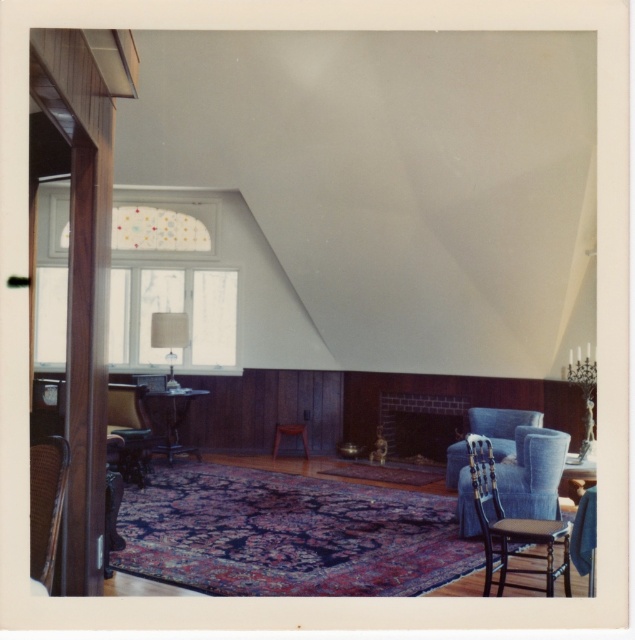
You are sitting in the wooden chair at lower right and want to place a book on the wooden side table at center. Can you reach it without moving from your seat?

The wooden chair at lower right is located below the wooden side table at center, meaning the side table is higher up. Since you are sitting in the chair, you might need to stand or use a step stool to reach the table unless it is within arm sreach.

You are standing in the room and want to place a small table between the wooden chair at lower right and the white fabric lampshade at center. Can you do this without moving either object?

The wooden chair at lower right is located below the white fabric lampshade at center, so there is space between them to place a small table without moving either object.

In the scene shown: You are arranging a small table between the wooden chair at lower right and the white fabric lampshade at center. Which side of the lampshade should you place the table to ensure it aligns with the chair?

The wooden chair at lower right is to the right of the white fabric lampshade at center, so you should place the table to the right side of the lampshade to align it with the chair.